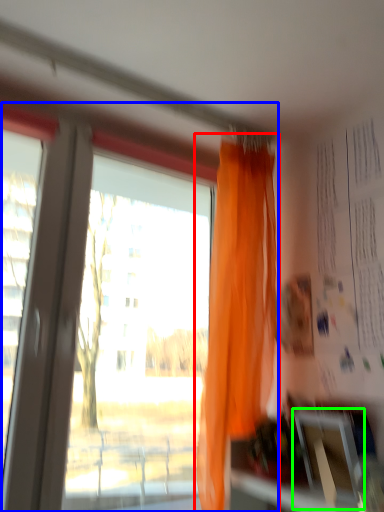
Question: Estimate the real-world distances between objects in this image. Which object is closer to curtain (highlighted by a red box), window (highlighted by a blue box) or window screen (highlighted by a green box)?

Choices:
 (A) window
 (B) window screen

Answer: (B)